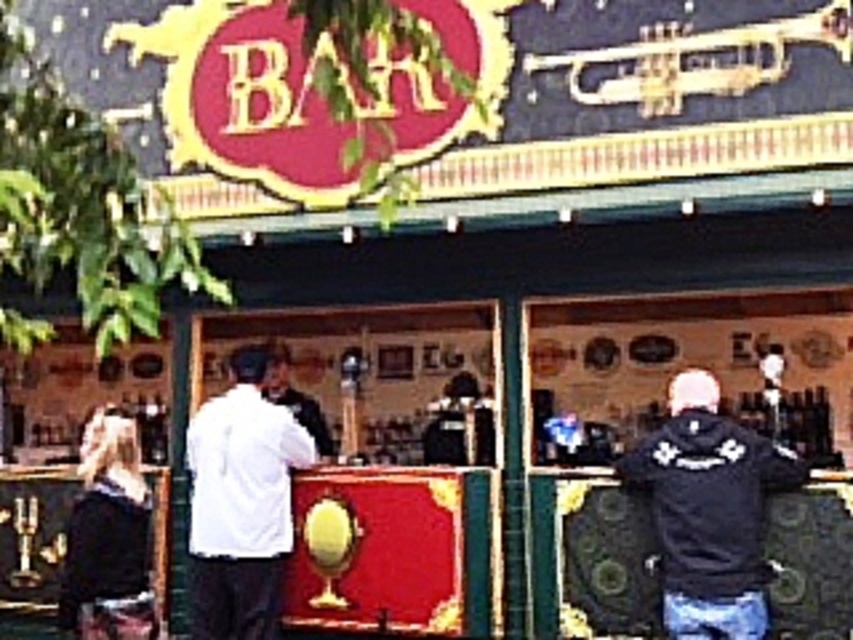
You are standing in front of the bar counter and want to place a new menu holder. The menu holder requires a space that is exactly at the center of the bar counter. Is the white matte shirt at center currently occupying that spot?

The white matte shirt at center is located at point (241, 502), which is not exactly at the center of the bar counter. Therefore, the menu holder can be placed at the center without displacing the white matte shirt at center.

You are a customer at the bar and want to order a drink. You see a black matte jacket at right and a white matte shirt at center. Which item is nearer to you?

The black matte jacket at right is closer to the viewer than the white matte shirt at center, so the black matte jacket at right is nearer to you.

Consider the image. You are a customer at the bar and want to place your drink order. The bartender is standing behind the counter. Where should you look to see the gold brass trumpet at upper right?

The gold brass trumpet at upper right is located at coordinates point (x=694, y=60), so you should look towards the upper right area of the bar counter to see it.